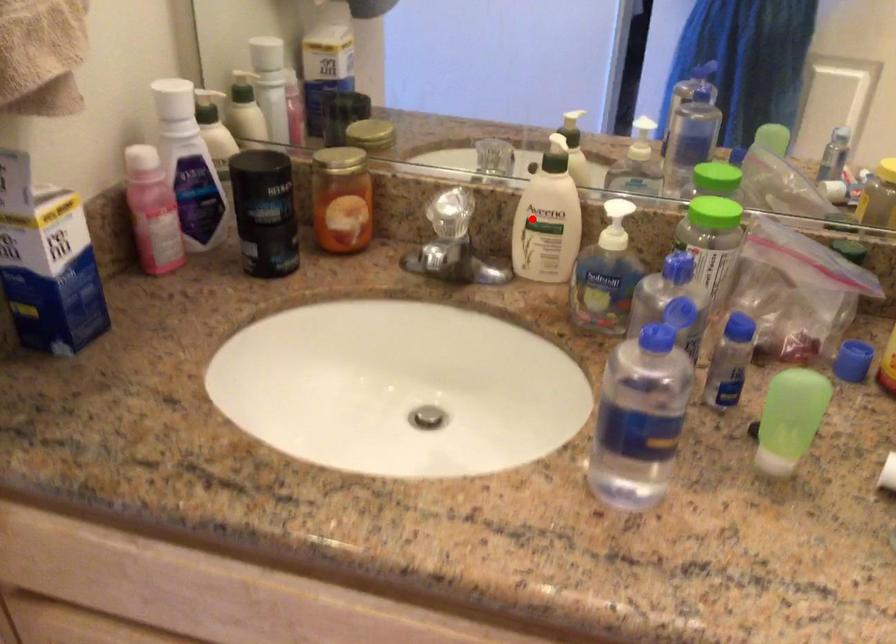
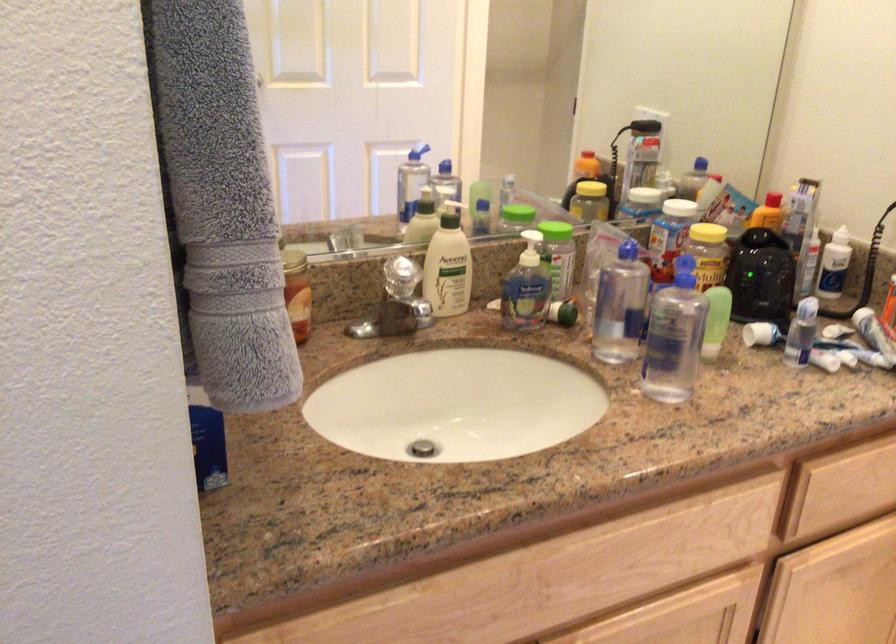
The point at the highlighted location is marked in the first image. Where is the corresponding point in the second image?

(448, 265)